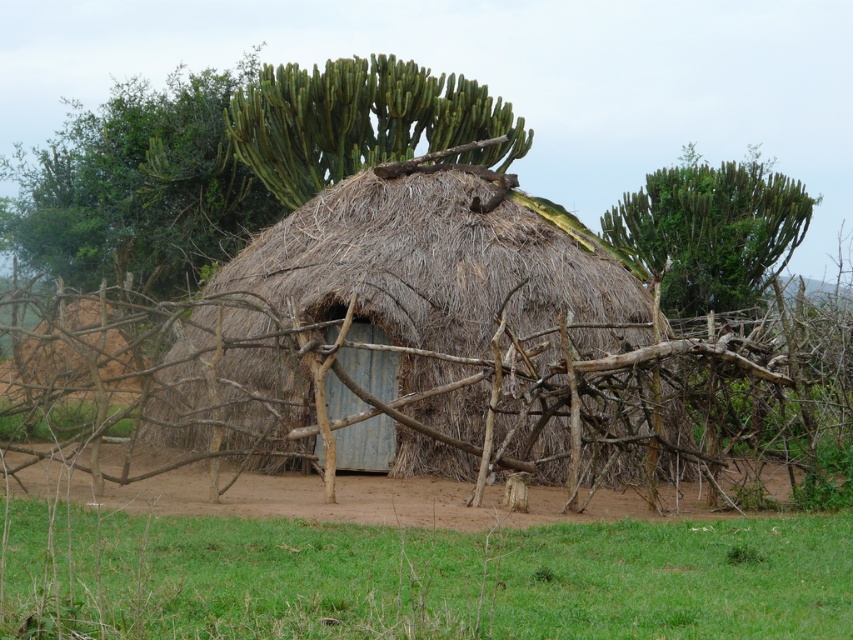
You are standing in front of the thatched straw hut at center and want to take a photo of the green spiky cactus at upper center. Which object should you focus on first to ensure both are in the frame?

You should focus on the thatched straw hut at center first because it is closer to you than the green spiky cactus at upper center, ensuring both are in focus.

You are standing in the rural area depicted in the image. You see a point marked at coordinates (x=401, y=330). What object is located at that point?

The point at coordinates (x=401, y=330) marks the thatched straw hut at center.

You are standing in front of the thatched hut and want to walk towards the green spiky cactus at upper center and the green spiky cactus at upper right. Which cactus will you reach first?

You will reach the green spiky cactus at upper center first because it is closer to you than the green spiky cactus at upper right, which is further away.